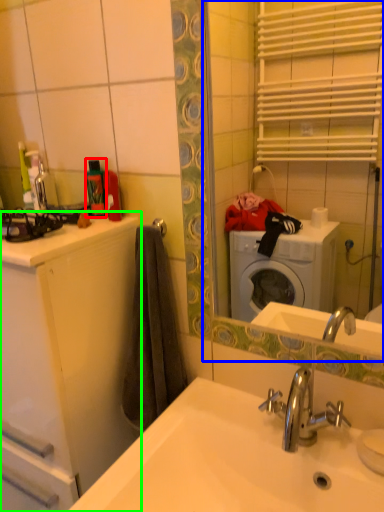
Question: Considering the real-world distances, which object is closest to toiletry (highlighted by a red box)? mirror (highlighted by a blue box) or bathroom cabinet (highlighted by a green box).

Choices:
 (A) mirror
 (B) bathroom cabinet

Answer: (B)